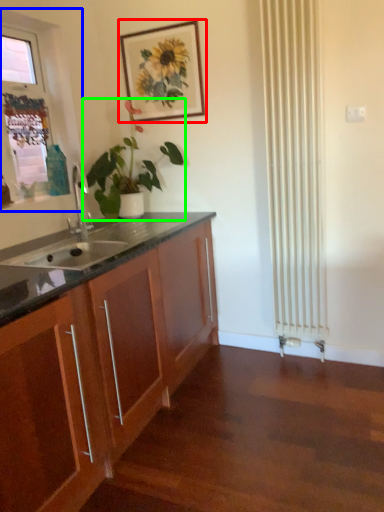
Question: Considering the real-world distances, which object is closest to picture frame (highlighted by a red box)? window frame (highlighted by a blue box) or houseplant (highlighted by a green box).

Choices:
 (A) window frame
 (B) houseplant

Answer: (B)